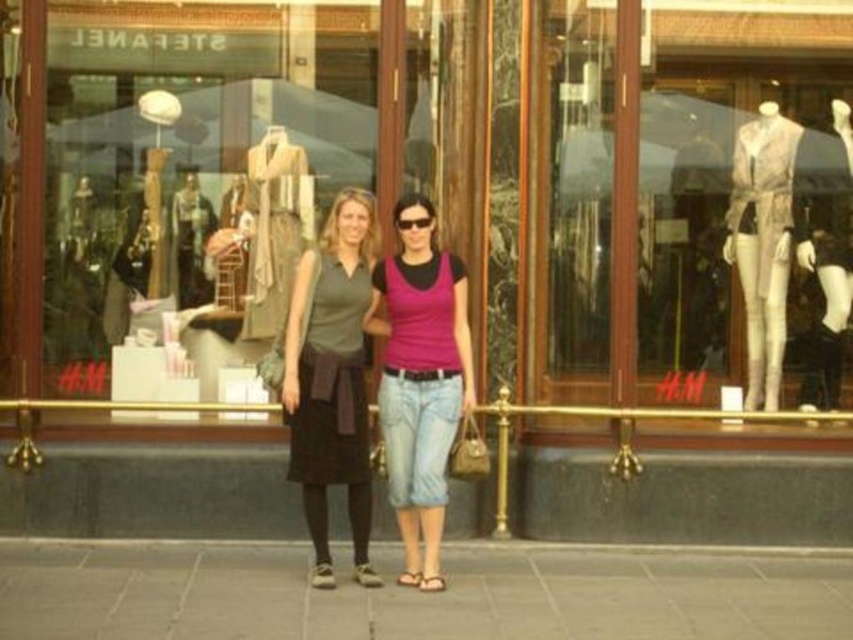
Question: Can you confirm if gray concrete pavement at lower center is smaller than pink matte tank top at center?

Choices:
 (A) yes
 (B) no

Answer: (A)

Question: Does gray concrete pavement at lower center appear on the left side of pink matte tank top at center?

Choices:
 (A) yes
 (B) no

Answer: (B)

Question: Which object appears closest to the camera in this image?

Choices:
 (A) matte gray skirt at center
 (B) matte glass display at center
 (C) pink matte tank top at center
 (D) gray concrete pavement at lower center

Answer: (D)

Question: Considering the relative positions of matte glass display at center and matte gray skirt at center in the image provided, where is matte glass display at center located with respect to matte gray skirt at center?

Choices:
 (A) above
 (B) below

Answer: (A)

Question: Which object appears closest to the camera in this image?

Choices:
 (A) gray concrete pavement at lower center
 (B) matte glass display at center
 (C) pink matte tank top at center

Answer: (A)

Question: Which point is closer to the camera taking this photo?

Choices:
 (A) (325, 372)
 (B) (405, 525)

Answer: (A)